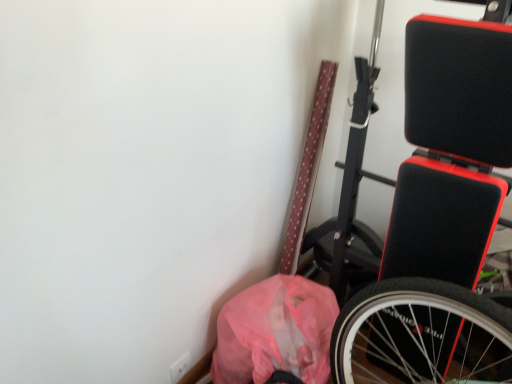
Question: From a real-world perspective, is black matte exercise bench at right physically located above or below pink plastic bag at lower right?

Choices:
 (A) below
 (B) above

Answer: (B)

Question: Relative to pink plastic bag at lower right, is black matte exercise bench at right in front or behind?

Choices:
 (A) behind
 (B) front

Answer: (B)

Question: Considering the positions of point (419, 173) and point (215, 357), is point (419, 173) closer or farther from the camera than point (215, 357)?

Choices:
 (A) farther
 (B) closer

Answer: (B)

Question: Would you say pink plastic bag at lower right is to the left or to the right of black matte exercise bench at right in the picture?

Choices:
 (A) right
 (B) left

Answer: (B)

Question: From a real-world perspective, is pink plastic bag at lower right positioned above or below black matte exercise bench at right?

Choices:
 (A) below
 (B) above

Answer: (A)

Question: Considering the positions of pink plastic bag at lower right and black matte exercise bench at right in the image, is pink plastic bag at lower right taller or shorter than black matte exercise bench at right?

Choices:
 (A) tall
 (B) short

Answer: (B)

Question: From the image's perspective, is pink plastic bag at lower right located above or below black matte exercise bench at right?

Choices:
 (A) below
 (B) above

Answer: (A)